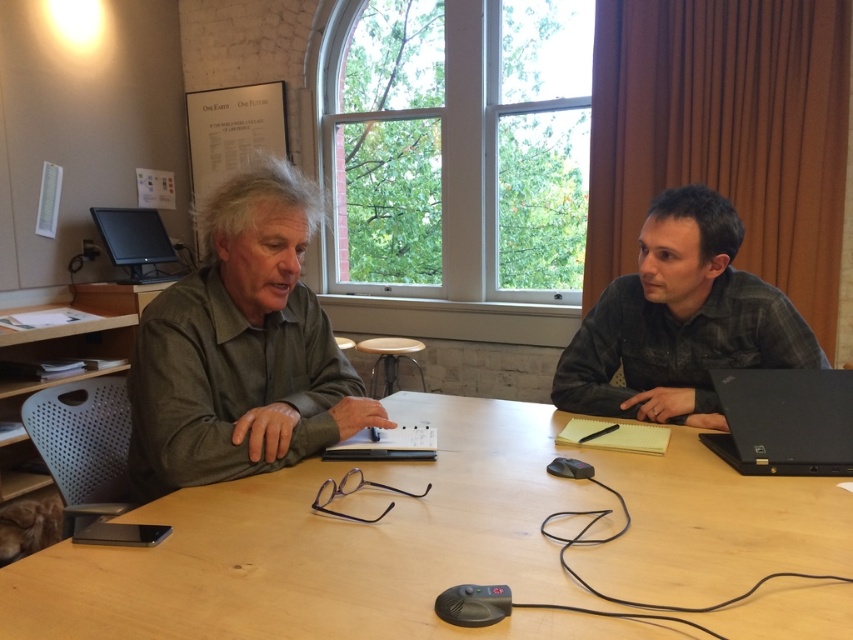
You are standing in the meeting room and need to place a document on the light brown wood table at center. Can you confirm the exact coordinates where the table is located?

The light brown wood table at center is located at point (437, 541).

You are a photographer setting up a shot of the two people at the table. You want to ensure that both the plaid shirt at right and the black matte laptop at right are fully visible in the frame. Based on their positions, which object might require you to adjust the camera angle more to include it in the shot?

The plaid shirt at right might be wider than the black matte laptop at right, so it could require a wider camera angle to ensure it is fully visible in the frame.

You are a person who wants to place a 15 cm tall coffee mug on the light brown wood table at center. Considering the height of the table and the green matte shirt at left, will the mug be visible to someone sitting at the table?

The light brown wood table at center has a lesser height compared to green matte shirt at left. Since the table is shorter than the shirt, the 15 cm tall coffee mug placed on the table might be partially obscured by the shirt if the person is sitting close enough. However, visibility could depend on the exact positioning and angles, but based on the height difference, there is a possibility the mug isn